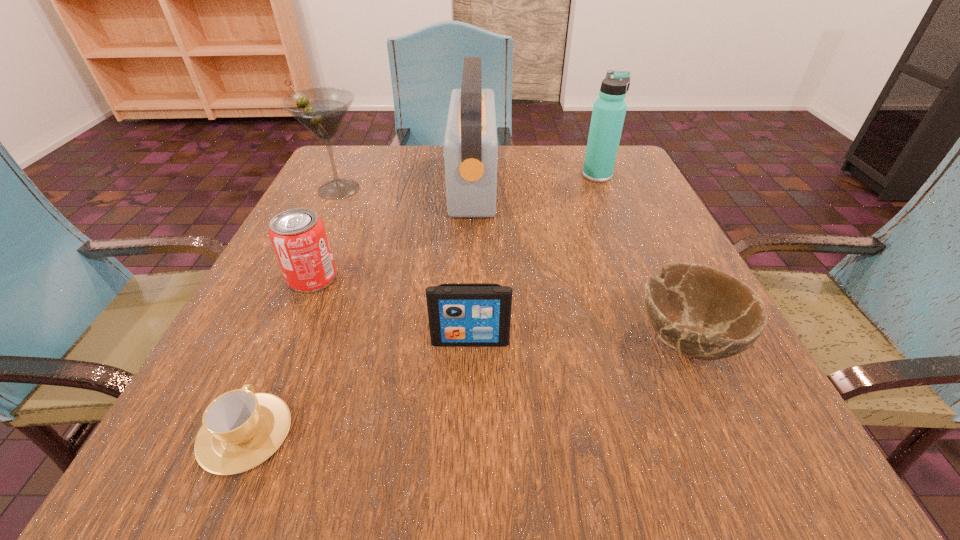
The image size is (960, 540). Identify the location of radio receiver. (470, 146).

This screenshot has height=540, width=960. Identify the location of thermos bottle. 609,110.

Image resolution: width=960 pixels, height=540 pixels. In order to click on martini in this screenshot , I will do `click(322, 110)`.

This screenshot has width=960, height=540. I want to click on the fourth farthest object, so click(x=298, y=236).

This screenshot has height=540, width=960. Identify the location of iPod. (460, 314).

Locate an element on the screen. bowl is located at coordinates (699, 311).

Identify the location of cup. The image size is (960, 540). (241, 429).

I want to click on the nearest object, so click(241, 429).

This screenshot has width=960, height=540. I want to click on vacant space located on the front-facing side of the radio receiver, so click(561, 183).

This screenshot has width=960, height=540. I want to click on free point located on the left of the thermos bottle, so click(x=522, y=176).